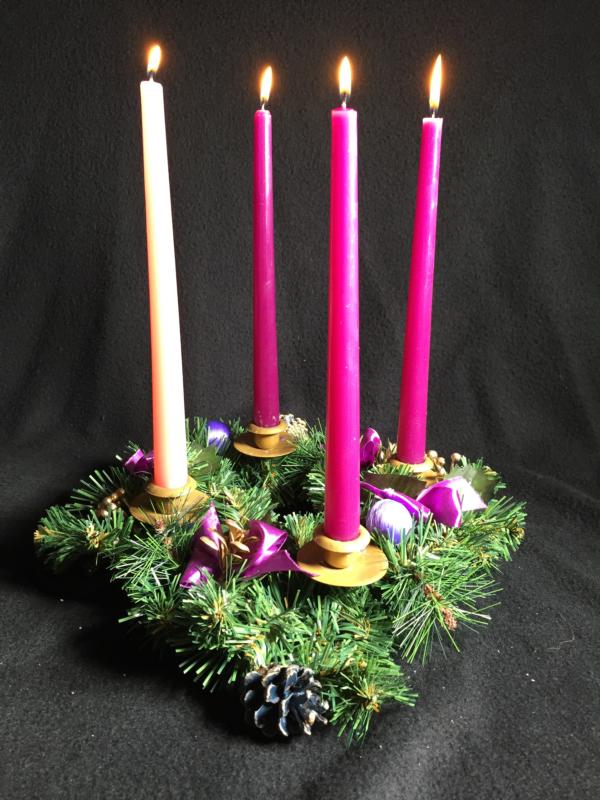
Where is `surface`? This screenshot has width=600, height=800. surface is located at coordinates (147, 706).